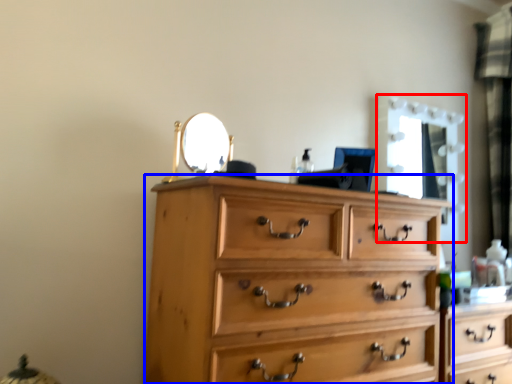
Question: Which of the following is the closest to the observer, mirror (highlighted by a red box) or chest of drawers (highlighted by a blue box)?

Choices:
 (A) mirror
 (B) chest of drawers

Answer: (B)